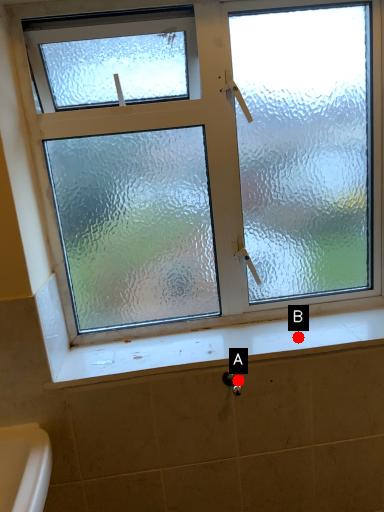
Question: Two points are circled on the image, labeled by A and B beside each circle. Among these points, which one is farthest from the camera?

Choices:
 (A) A is further
 (B) B is further

Answer: (B)